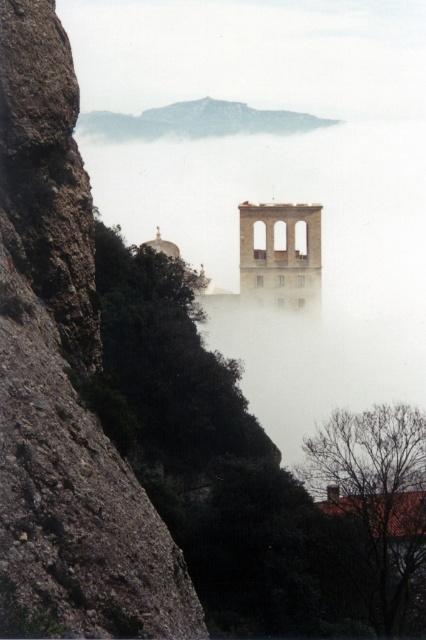
Is point (271, 221) positioned behind point (167, 120)?

No, (271, 221) is in front of (167, 120).

Which is in front, point (241, 269) or point (238, 109)?

Point (241, 269)

You are a GUI agent. You are given a task and a screenshot of the screen. Output one action in this format:
    pyautogui.click(x=<x>, y=<y>)
    Task: Click on the smooth stone bell tower at center
    This screenshot has height=640, width=426.
    Given the screenshot: What is the action you would take?
    pyautogui.click(x=279, y=252)

Which is behind, point (19, 492) or point (236, 125)?

Point (236, 125)

Does point (48, 509) come in front of point (161, 129)?

Yes, it is in front of point (161, 129).

Where is `rough stone cliff at left`? The image size is (426, 640). rough stone cliff at left is located at coordinates (65, 372).

Between rough stone cliff at left and smooth stone bell tower at center, which one appears on the left side from the viewer's perspective?

rough stone cliff at left

Which is behind, point (80, 320) or point (259, 294)?

Positioned behind is point (259, 294).

Which is in front, point (5, 326) or point (293, 253)?

Positioned in front is point (5, 326).

Identify the location of rough stone cliff at left. Image resolution: width=426 pixels, height=640 pixels. (65, 372).